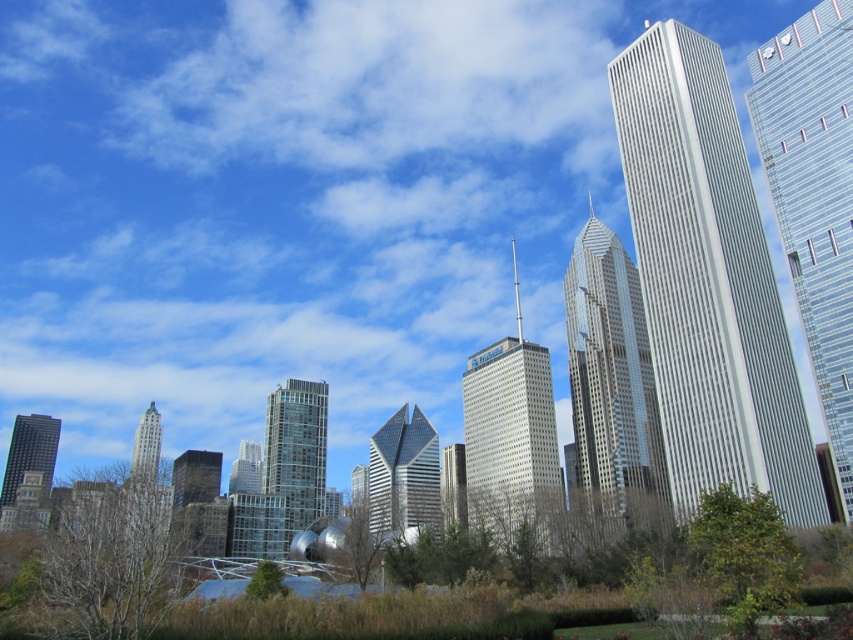
Who is higher up, transparent glass skyscraper at right or glassy reflective skyscraper at center?

transparent glass skyscraper at right is above.

Consider the image. Which is more to the left, transparent glass skyscraper at right or glassy reflective skyscraper at center?

Positioned to the left is glassy reflective skyscraper at center.

The image size is (853, 640). What are the coordinates of `transparent glass skyscraper at right` in the screenshot? It's located at (814, 196).

Locate an element on the screen. The height and width of the screenshot is (640, 853). transparent glass skyscraper at right is located at coordinates (814, 196).

Who is positioned more to the right, green grass at lower center or glassy steel skyscraper at center?

green grass at lower center is more to the right.

Between point (656, 561) and point (393, 506), which one is positioned in front?

Point (656, 561) is in front.

Where is `green grass at lower center`? green grass at lower center is located at coordinates (296, 616).

Is silver glass skyscraper at upper right shorter than green grass at lower center?

Incorrect, silver glass skyscraper at upper right's height does not fall short of green grass at lower center's.

Locate an element on the screen. The image size is (853, 640). silver glass skyscraper at upper right is located at coordinates click(x=708, y=282).

Image resolution: width=853 pixels, height=640 pixels. Find the location of `silver glass skyscraper at upper right`. silver glass skyscraper at upper right is located at coordinates (708, 282).